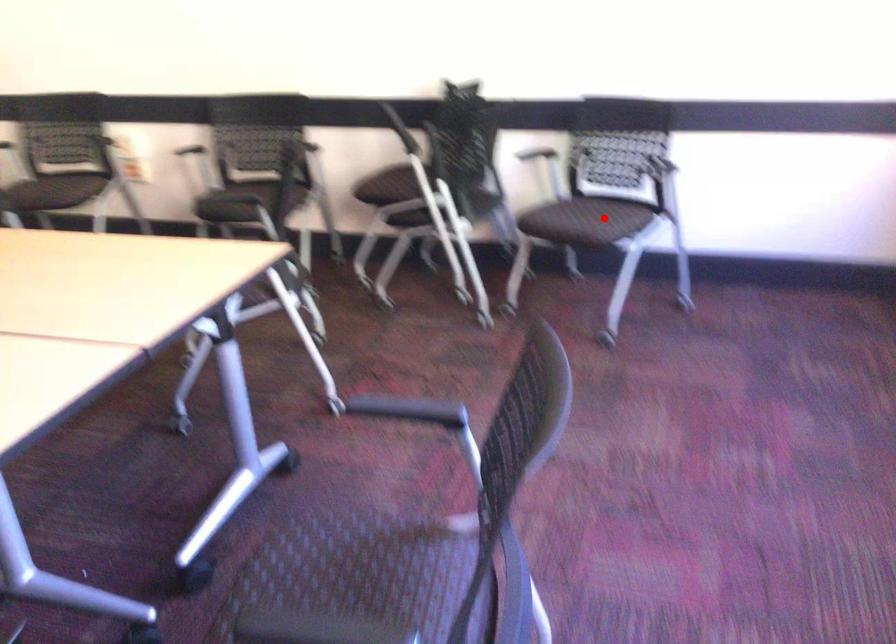
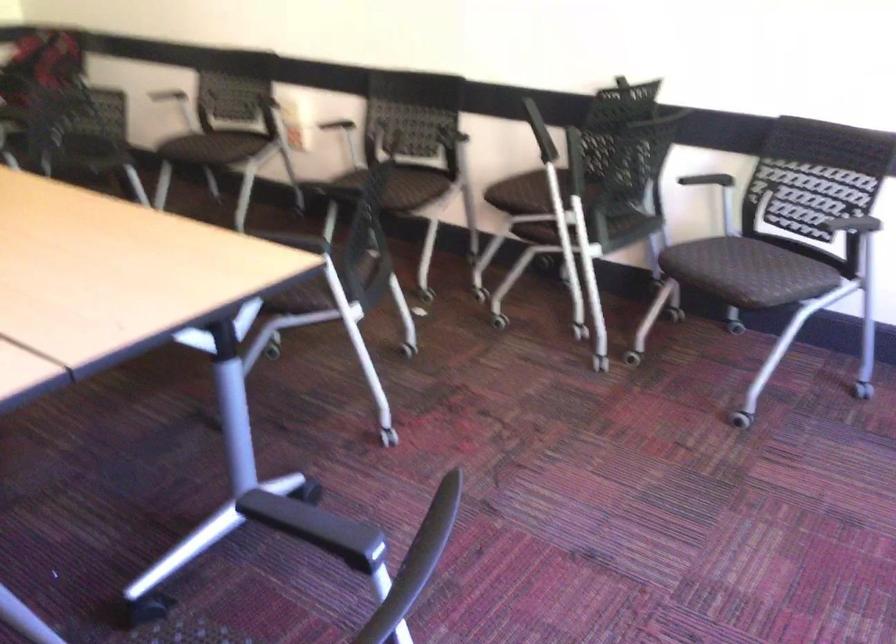
The point at the highlighted location is marked in the first image. Where is the corresponding point in the second image?

(764, 272)